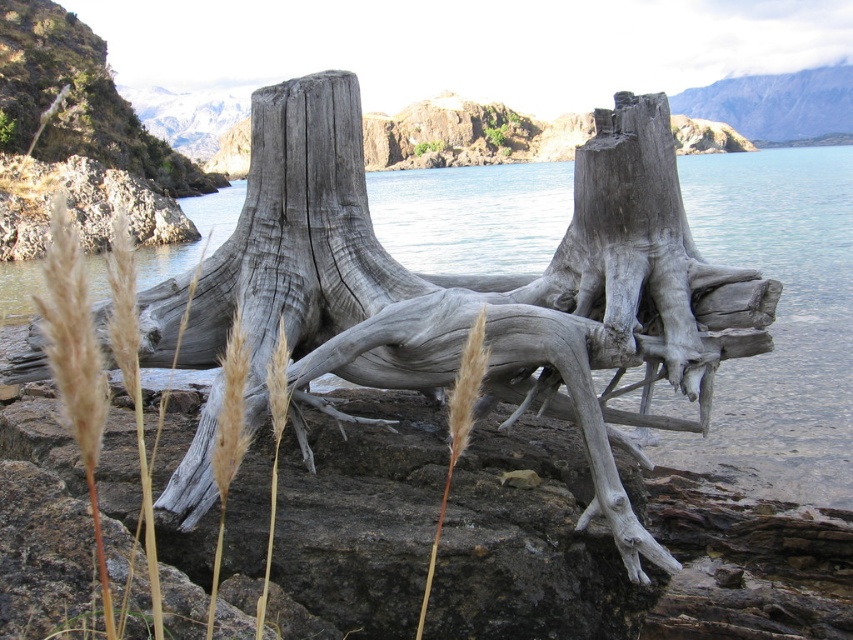
Question: Which object is farther from the camera taking this photo?

Choices:
 (A) clear blue water at center
 (B) brown fuzzy grass at center

Answer: (A)

Question: Can you confirm if clear blue water at center is positioned to the left of brown fuzzy grass at center?

Choices:
 (A) no
 (B) yes

Answer: (A)

Question: Which point is closer to the camera?

Choices:
 (A) (482, 312)
 (B) (460, 182)

Answer: (A)

Question: Is clear blue water at center above brown fuzzy grass at center?

Choices:
 (A) no
 (B) yes

Answer: (B)

Question: Which object appears closest to the camera in this image?

Choices:
 (A) clear blue water at center
 (B) brown fuzzy grass at center

Answer: (B)

Question: Does clear blue water at center have a lesser width compared to brown fuzzy grass at center?

Choices:
 (A) yes
 (B) no

Answer: (B)